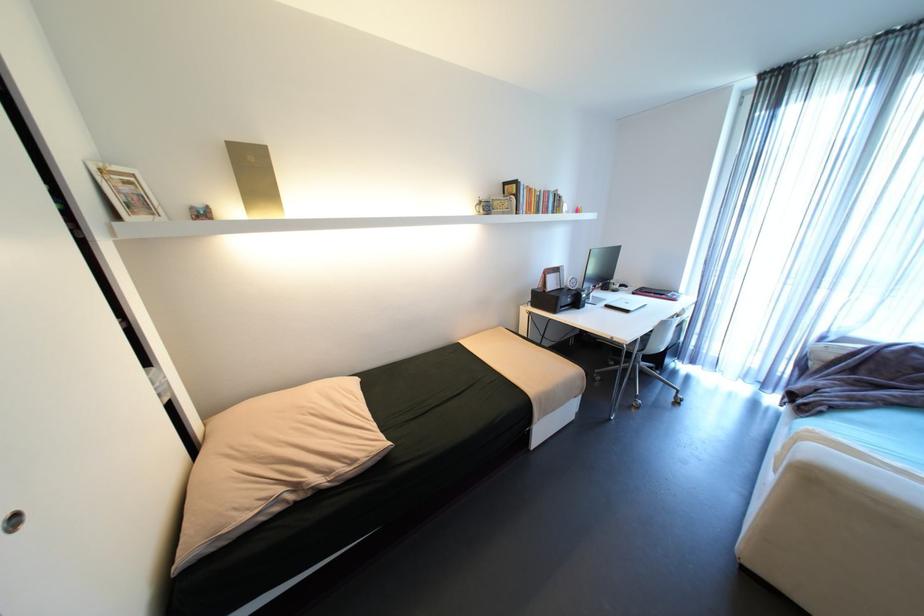
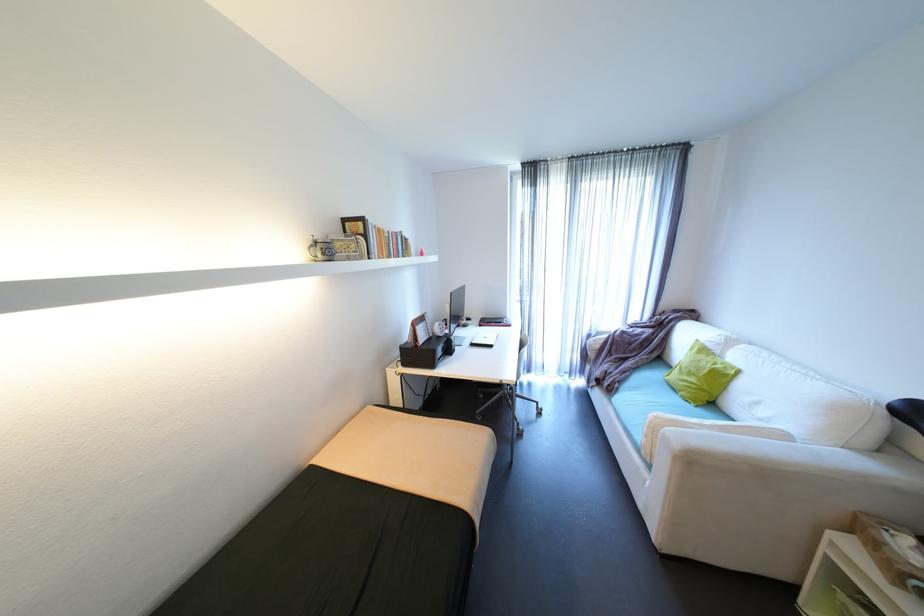
The point at (671, 294) is marked in the first image. Where is the corresponding point in the second image?

(508, 323)